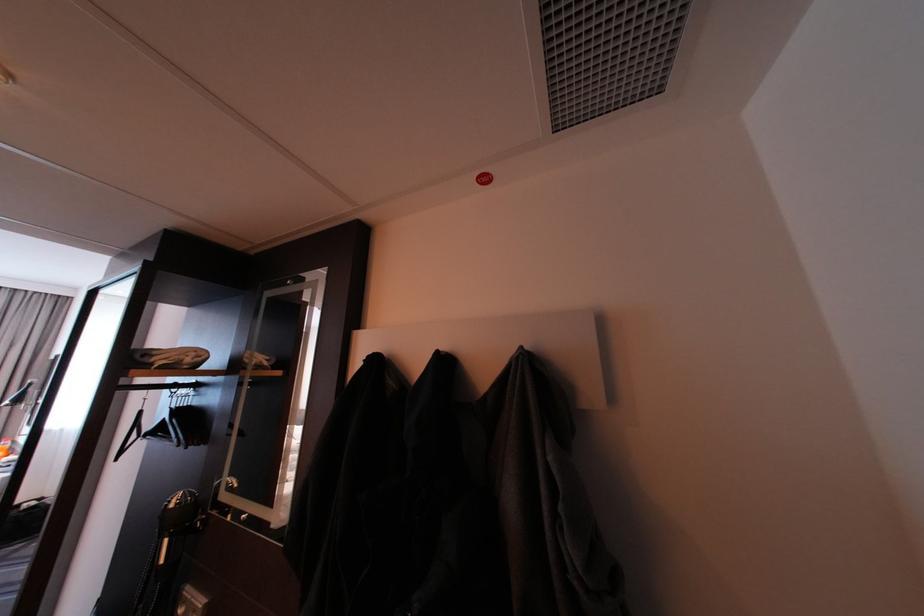
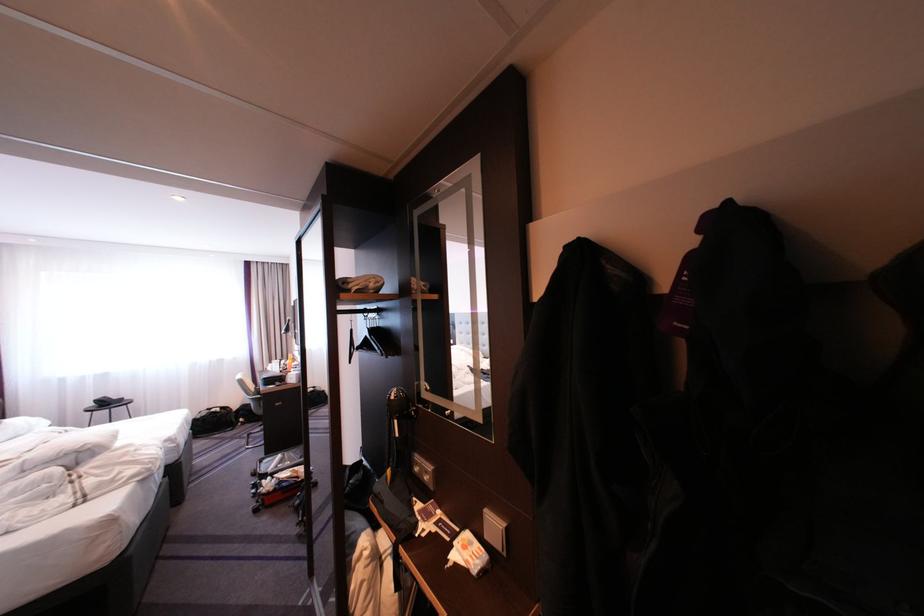
Where in the second image is the point corresponding to [186,498] from the first image?

(404, 392)